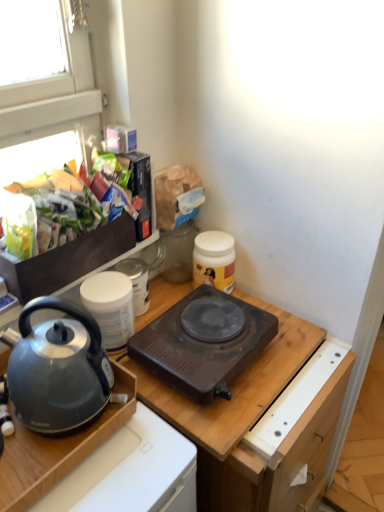
Question: Does shiny plastic bag of chips at upper left turn towards white matte jar at center?

Choices:
 (A) no
 (B) yes

Answer: (A)

Question: Is shiny plastic bag of chips at upper left wider than white matte jar at center?

Choices:
 (A) no
 (B) yes

Answer: (B)

Question: Considering the relative positions of shiny plastic bag of chips at upper left and white matte jar at center in the image provided, is shiny plastic bag of chips at upper left in front of white matte jar at center?

Choices:
 (A) yes
 (B) no

Answer: (A)

Question: Is shiny plastic bag of chips at upper left far away from white matte jar at center?

Choices:
 (A) no
 (B) yes

Answer: (A)

Question: From a real-world perspective, is shiny plastic bag of chips at upper left positioned over white matte jar at center based on gravity?

Choices:
 (A) yes
 (B) no

Answer: (A)

Question: Does shiny plastic bag of chips at upper left have a smaller size compared to white matte jar at center?

Choices:
 (A) no
 (B) yes

Answer: (A)

Question: From the image's perspective, is wooden cutting board at center beneath white matte jar at center?

Choices:
 (A) no
 (B) yes

Answer: (B)

Question: From a real-world perspective, is wooden cutting board at center positioned under white matte jar at center based on gravity?

Choices:
 (A) yes
 (B) no

Answer: (A)

Question: Is wooden cutting board at center beside white matte jar at center?

Choices:
 (A) yes
 (B) no

Answer: (B)

Question: Considering the relative sizes of wooden cutting board at center and white matte jar at center in the image provided, is wooden cutting board at center smaller than white matte jar at center?

Choices:
 (A) yes
 (B) no

Answer: (B)

Question: Is wooden cutting board at center positioned far away from white matte jar at center?

Choices:
 (A) no
 (B) yes

Answer: (A)

Question: Considering the relative sizes of wooden cutting board at center and white matte jar at center in the image provided, is wooden cutting board at center bigger than white matte jar at center?

Choices:
 (A) no
 (B) yes

Answer: (B)

Question: From a real-world perspective, is white matte container at upper left, arranged as the 3th kitchen appliance when viewed from the right, beneath yellow matte jar at upper right, which appears as the 3th kitchen appliance when viewed from the left?

Choices:
 (A) yes
 (B) no

Answer: (B)